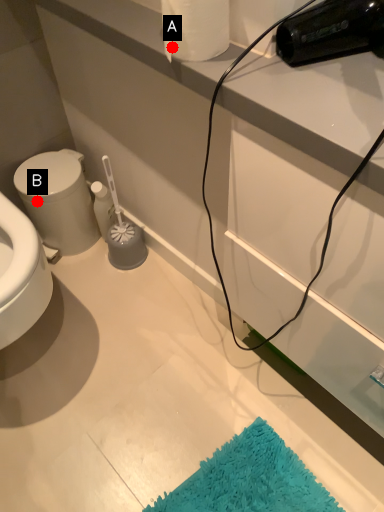
Question: Two points are circled on the image, labeled by A and B beside each circle. Which point is further to the camera?

Choices:
 (A) A is further
 (B) B is further

Answer: (B)